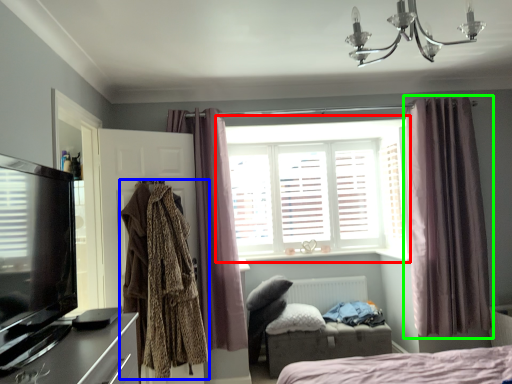
Question: Based on their relative distances, which object is farther from window (highlighted by a red box)? Choose from clothing (highlighted by a blue box) and curtain (highlighted by a green box).

Choices:
 (A) clothing
 (B) curtain

Answer: (A)